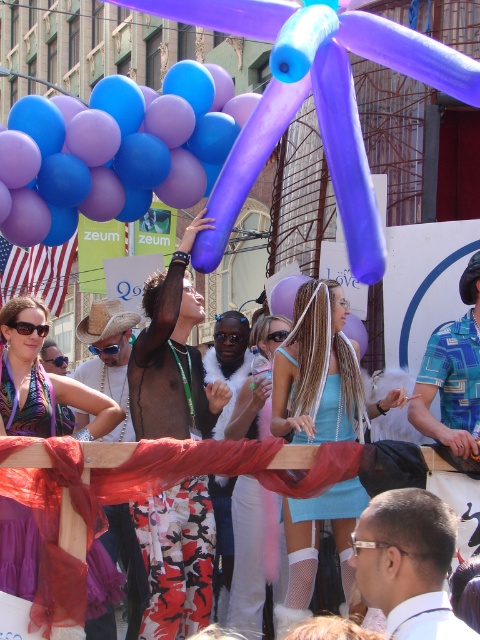
Question: Among these points, which one is farthest from the camera?

Choices:
 (A) (130, 97)
 (B) (453, 333)

Answer: (A)

Question: Is light blue fabric dress at center to the right of smooth black hair at center from the viewer's perspective?

Choices:
 (A) yes
 (B) no

Answer: (B)

Question: Considering the real-world distances, which object is farthest from the light blue fabric dress at center?

Choices:
 (A) blue printed shirt at center
 (B) purple balloon at upper center
 (C) lavender rubber balloon at upper center
 (D) purple chiffon scarf at upper left

Answer: (C)

Question: Can you confirm if light blue fabric dress at center is positioned to the right of blue printed shirt at center?

Choices:
 (A) yes
 (B) no

Answer: (B)

Question: Which of the following is the farthest from the observer?

Choices:
 (A) light blue fabric dress at center
 (B) floral-patterned shorts at center

Answer: (A)

Question: Can you confirm if purple balloon at upper center is positioned below floral-patterned shorts at center?

Choices:
 (A) no
 (B) yes

Answer: (B)